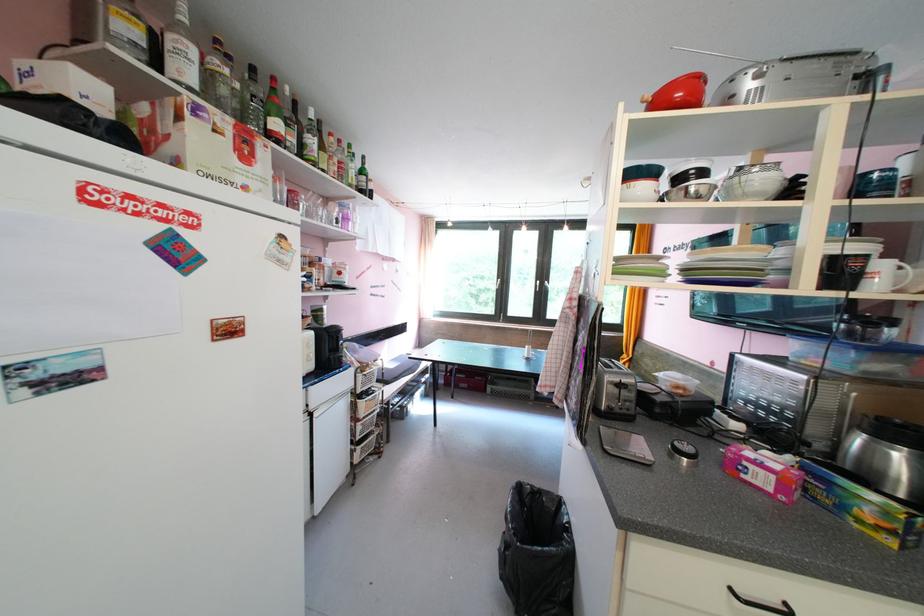
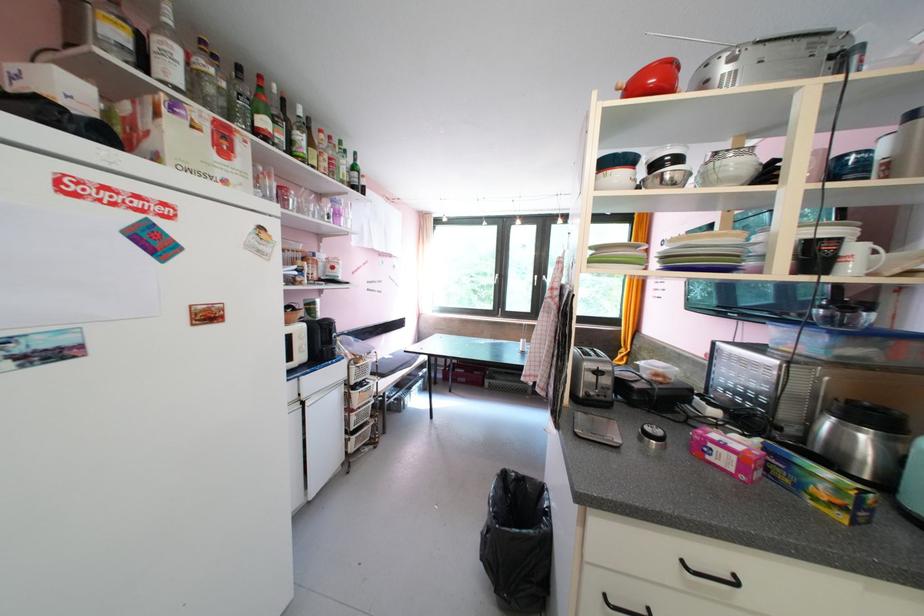
The point at (302, 143) is marked in the first image. Where is the corresponding point in the second image?

(290, 140)